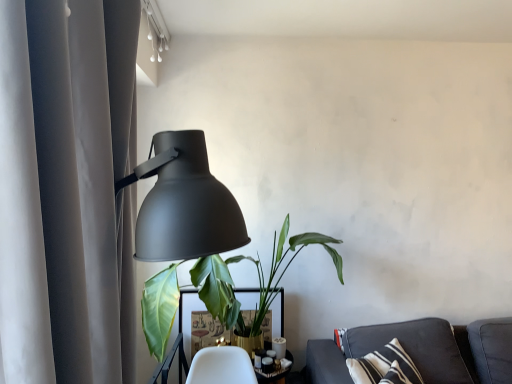
Question: From a real-world perspective, is matte gray curtain at left below white glossy table at center?

Choices:
 (A) no
 (B) yes

Answer: (A)

Question: Considering the relative positions of matte gray curtain at left and white glossy table at center in the image provided, is matte gray curtain at left in front of white glossy table at center?

Choices:
 (A) yes
 (B) no

Answer: (A)

Question: From the image's perspective, is matte gray curtain at left located above white glossy table at center?

Choices:
 (A) yes
 (B) no

Answer: (A)

Question: Considering the relative sizes of matte gray curtain at left and white glossy table at center in the image provided, is matte gray curtain at left taller than white glossy table at center?

Choices:
 (A) no
 (B) yes

Answer: (B)

Question: Can you confirm if matte gray curtain at left is shorter than white glossy table at center?

Choices:
 (A) yes
 (B) no

Answer: (B)

Question: Considering the positions of matte black lamp at left and dark gray fabric couch at lower right in the image, is matte black lamp at left wider or thinner than dark gray fabric couch at lower right?

Choices:
 (A) wide
 (B) thin

Answer: (B)

Question: From the image's perspective, relative to dark gray fabric couch at lower right, is matte black lamp at left above or below?

Choices:
 (A) below
 (B) above

Answer: (B)

Question: Is matte black lamp at left taller or shorter than dark gray fabric couch at lower right?

Choices:
 (A) tall
 (B) short

Answer: (A)

Question: From a real-world perspective, is matte black lamp at left physically located above or below dark gray fabric couch at lower right?

Choices:
 (A) below
 (B) above

Answer: (B)

Question: Considering their positions, is matte gray curtain at left located in front of or behind white glossy table at center?

Choices:
 (A) behind
 (B) front

Answer: (B)

Question: In terms of size, does matte gray curtain at left appear bigger or smaller than white glossy table at center?

Choices:
 (A) small
 (B) big

Answer: (B)

Question: Considering the positions of point (27, 235) and point (251, 301), is point (27, 235) closer or farther from the camera than point (251, 301)?

Choices:
 (A) farther
 (B) closer

Answer: (B)

Question: From a real-world perspective, is matte gray curtain at left physically located above or below white glossy table at center?

Choices:
 (A) below
 (B) above

Answer: (B)

Question: From their relative heights in the image, would you say dark gray fabric couch at lower right is taller or shorter than white glossy table at center?

Choices:
 (A) tall
 (B) short

Answer: (B)

Question: Relative to white glossy table at center, is dark gray fabric couch at lower right in front or behind?

Choices:
 (A) front
 (B) behind

Answer: (A)